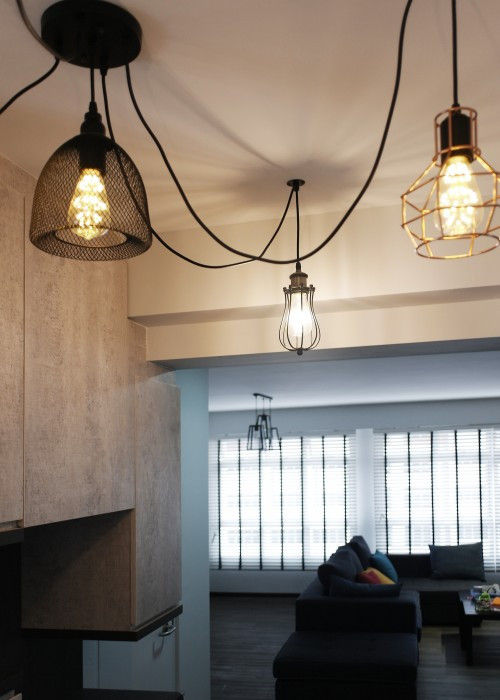
Locate an element on the screen. This screenshot has width=500, height=700. blue scatter cushion is located at coordinates (388, 565).